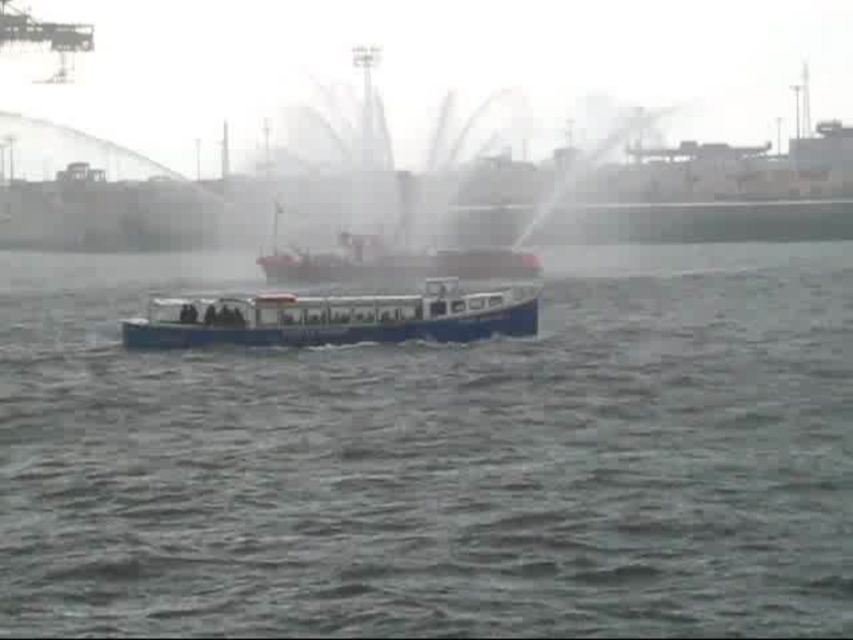
Question: Among these objects, which one is nearest to the camera?

Choices:
 (A) blue matte water at center
 (B) white plastic boat at center

Answer: (A)

Question: Is the position of blue matte water at center more distant than that of white plastic boat at center?

Choices:
 (A) yes
 (B) no

Answer: (B)

Question: In this image, where is blue matte water at center located relative to white plastic boat at center?

Choices:
 (A) left
 (B) right

Answer: (B)

Question: Which object is closer to the camera taking this photo?

Choices:
 (A) white plastic boat at center
 (B) blue matte water at center

Answer: (B)

Question: In this image, where is blue matte water at center located relative to white plastic boat at center?

Choices:
 (A) left
 (B) right

Answer: (B)

Question: Which object appears farthest from the camera in this image?

Choices:
 (A) white plastic boat at center
 (B) blue matte water at center

Answer: (A)